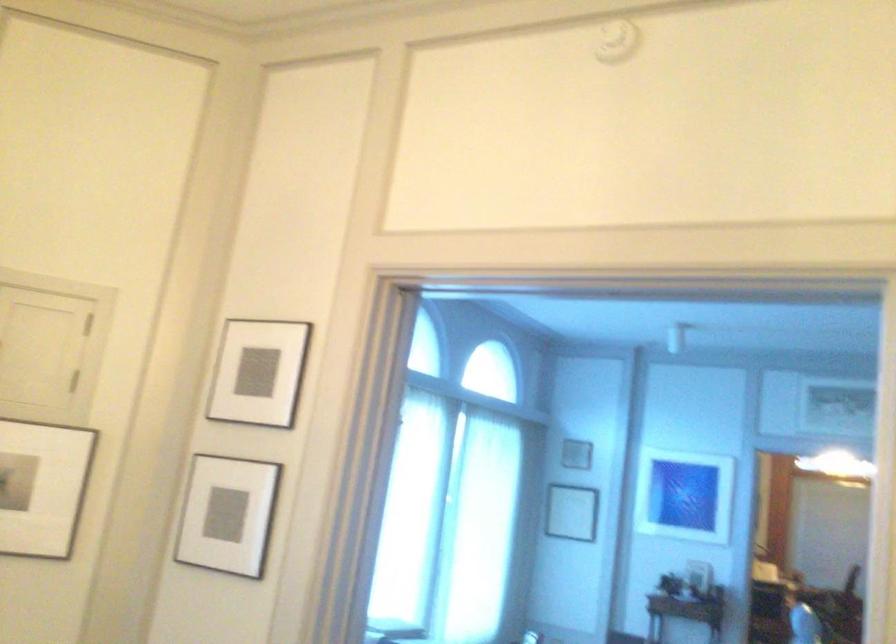
Describe the element at coordinates (49, 346) in the screenshot. The width and height of the screenshot is (896, 644). I see `the small cabinet door` at that location.